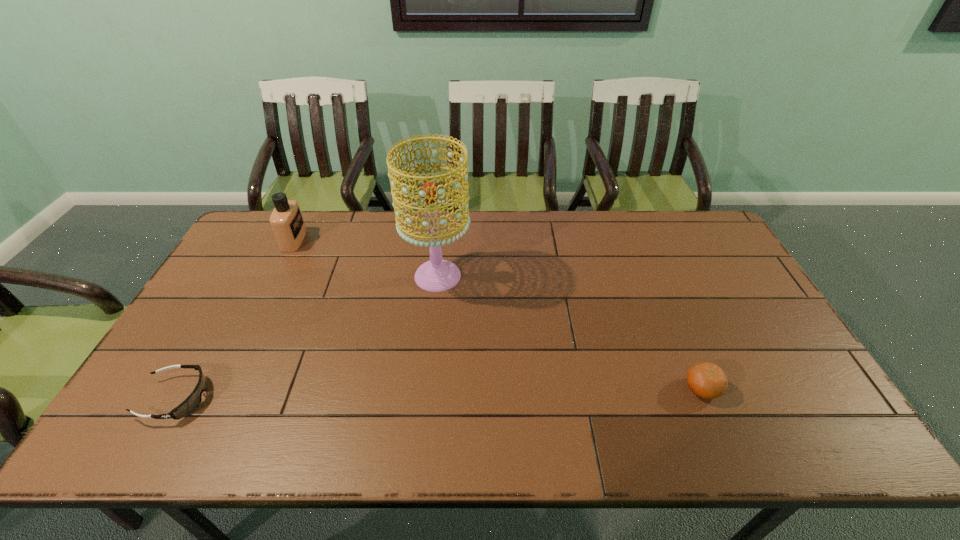
The image size is (960, 540). What are the coordinates of `free space at the right edge` in the screenshot? It's located at (694, 255).

You are a GUI agent. You are given a task and a screenshot of the screen. Output one action in this format:
    pyautogui.click(x=<x>, y=<y>)
    Task: Click on the vacant space at the far left corner of the desktop
    
    Given the screenshot: What is the action you would take?
    pyautogui.click(x=261, y=227)

In the image, there is a desktop. Where is `free space at the far right corner`? The height and width of the screenshot is (540, 960). free space at the far right corner is located at coordinates (706, 220).

Where is `free space at the near right corner of the desktop`? free space at the near right corner of the desktop is located at coordinates (786, 443).

Where is `vacant region between the second object from right to left and the third shortest object`? The image size is (960, 540). vacant region between the second object from right to left and the third shortest object is located at coordinates (366, 258).

Identify the location of vacant area that lies between the shortest object and the clementine. (439, 393).

The height and width of the screenshot is (540, 960). Find the location of `free spot between the lampshade and the farthest object`. free spot between the lampshade and the farthest object is located at coordinates (366, 258).

Locate an element on the screen. The width and height of the screenshot is (960, 540). empty space between the tallest object and the clementine is located at coordinates (570, 332).

Identify the location of vacant space in between the second shortest object and the shortest object. (439, 393).

Where is `free space between the lampshade and the farthest object`? The width and height of the screenshot is (960, 540). free space between the lampshade and the farthest object is located at coordinates (366, 258).